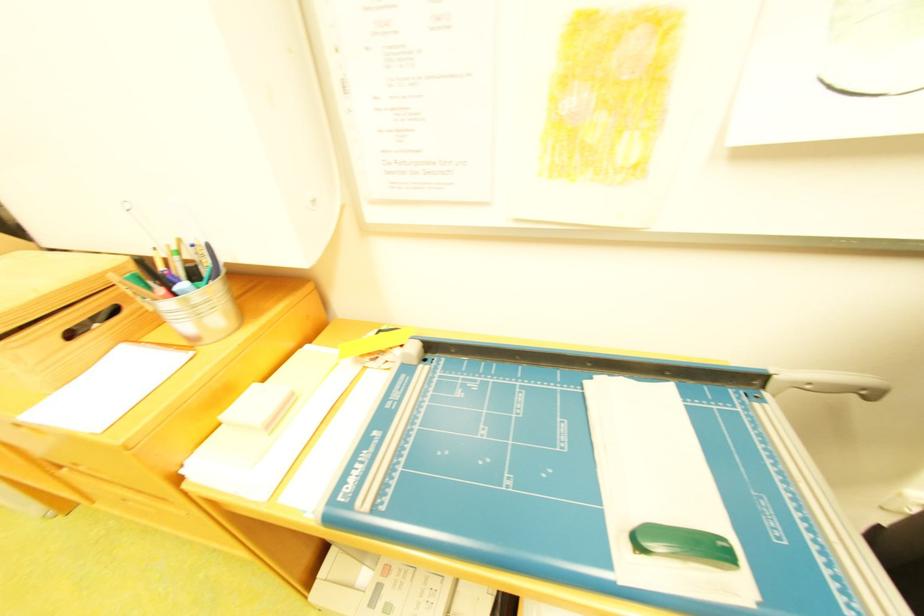
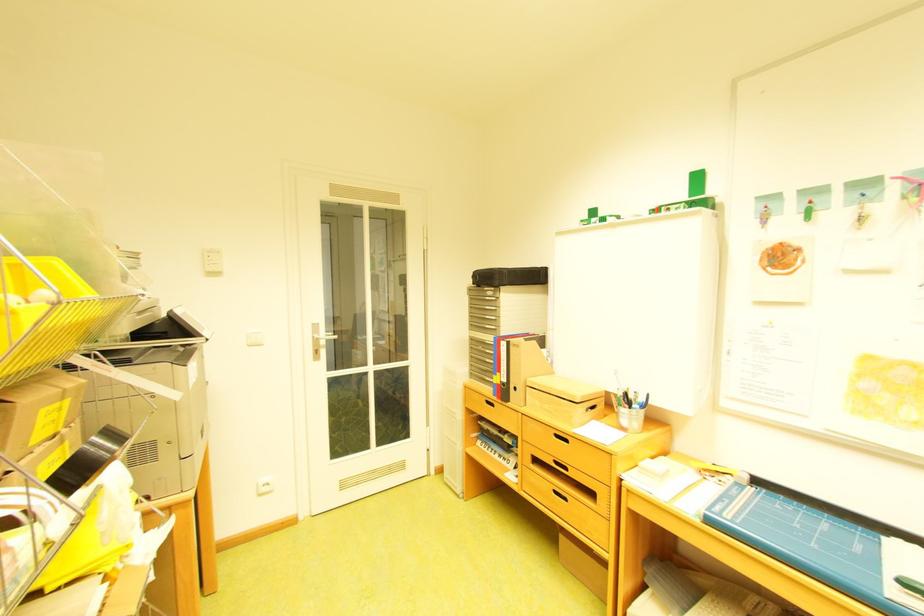
Where in the second image is the point corresponding to point 394,492 from the first image?

(747, 517)